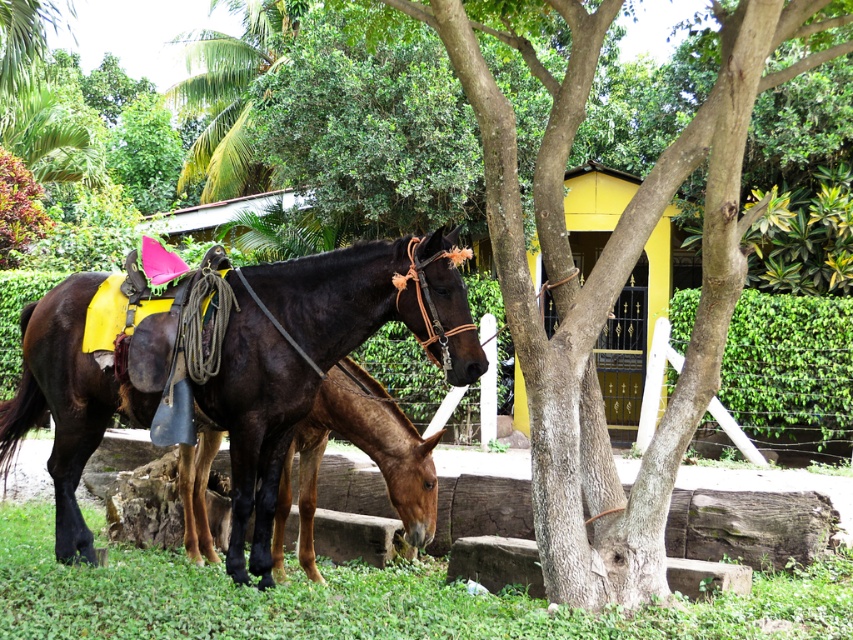
Which of these two, shiny dark brown horse at center or brown glossy horse at center, stands taller?

shiny dark brown horse at center is taller.

Between shiny dark brown horse at center and brown glossy horse at center, which one appears on the right side from the viewer's perspective?

brown glossy horse at center is more to the right.

Which is in front, point (292, 406) or point (341, 369)?

Positioned in front is point (292, 406).

At what (x,y) coordinates should I click in order to perform the action: click on shiny dark brown horse at center. Please return your answer as a coordinate pair (x, y). The height and width of the screenshot is (640, 853). Looking at the image, I should click on (314, 356).